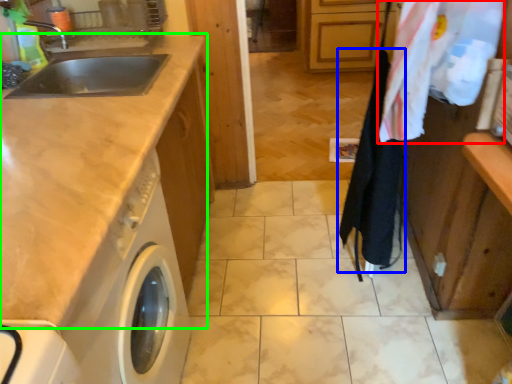
Question: Estimate the real-world distances between objects in this image. Which object is closer to laundry (highlighted by a red box), clothesline (highlighted by a blue box) or countertop (highlighted by a green box)?

Choices:
 (A) clothesline
 (B) countertop

Answer: (A)